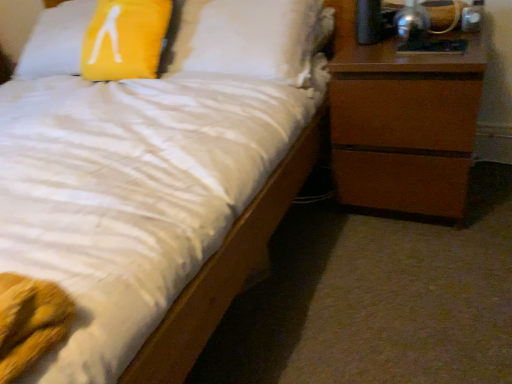
Question: Is metallic silver lamp at upper right oriented away from yellow fabric pillow at upper left?

Choices:
 (A) yes
 (B) no

Answer: (B)

Question: From a real-world perspective, is metallic silver lamp at upper right physically below yellow fabric pillow at upper left?

Choices:
 (A) no
 (B) yes

Answer: (A)

Question: Is metallic silver lamp at upper right directly adjacent to yellow fabric pillow at upper left?

Choices:
 (A) no
 (B) yes

Answer: (A)

Question: Is the position of metallic silver lamp at upper right more distant than that of yellow fabric pillow at upper left?

Choices:
 (A) no
 (B) yes

Answer: (A)

Question: Is yellow fabric pillow at upper left surrounded by metallic silver lamp at upper right?

Choices:
 (A) no
 (B) yes

Answer: (A)

Question: From a real-world perspective, relative to metallic silver lamp at upper right, is yellow fabric pillow at upper left vertically above or below?

Choices:
 (A) below
 (B) above

Answer: (A)

Question: From the image's perspective, is yellow fabric pillow at upper left located above or below metallic silver lamp at upper right?

Choices:
 (A) below
 (B) above

Answer: (B)

Question: Considering the positions of yellow fabric pillow at upper left and metallic silver lamp at upper right in the image, is yellow fabric pillow at upper left taller or shorter than metallic silver lamp at upper right?

Choices:
 (A) tall
 (B) short

Answer: (A)

Question: Do you think yellow fabric pillow at upper left is within metallic silver lamp at upper right, or outside of it?

Choices:
 (A) outside
 (B) inside

Answer: (A)

Question: Relative to metallic silver lamp at upper right, is brown wood chest of drawers at right in front or behind?

Choices:
 (A) behind
 (B) front

Answer: (B)

Question: Visually, is brown wood chest of drawers at right positioned to the left or to the right of metallic silver lamp at upper right?

Choices:
 (A) right
 (B) left

Answer: (A)

Question: Is brown wood chest of drawers at right wider or thinner than metallic silver lamp at upper right?

Choices:
 (A) thin
 (B) wide

Answer: (B)

Question: Considering the positions of point (417, 102) and point (429, 24), is point (417, 102) closer or farther from the camera than point (429, 24)?

Choices:
 (A) farther
 (B) closer

Answer: (B)

Question: Considering the positions of brown wood chest of drawers at right and yellow fabric pillow at upper left in the image, is brown wood chest of drawers at right wider or thinner than yellow fabric pillow at upper left?

Choices:
 (A) wide
 (B) thin

Answer: (A)

Question: Based on their positions, is brown wood chest of drawers at right located to the left or right of yellow fabric pillow at upper left?

Choices:
 (A) right
 (B) left

Answer: (A)